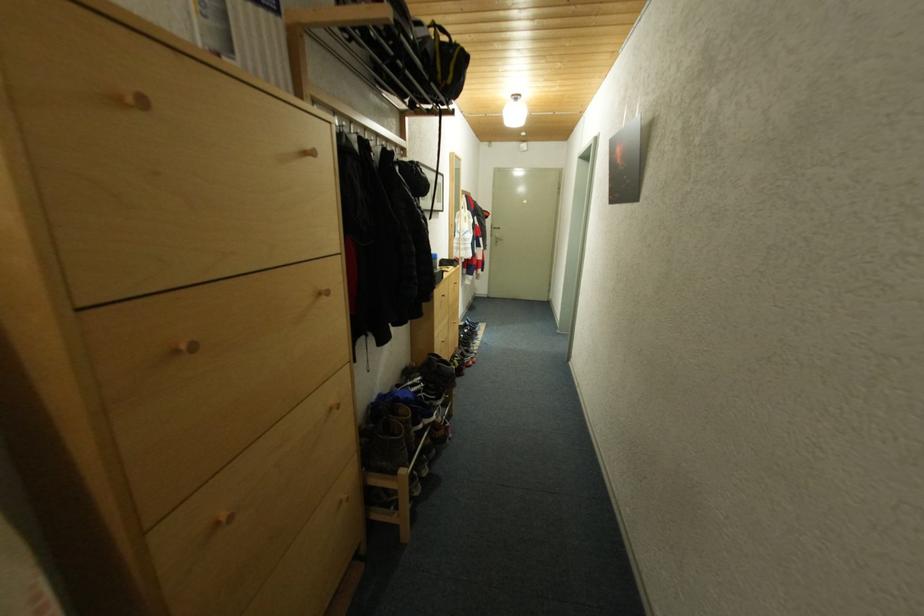
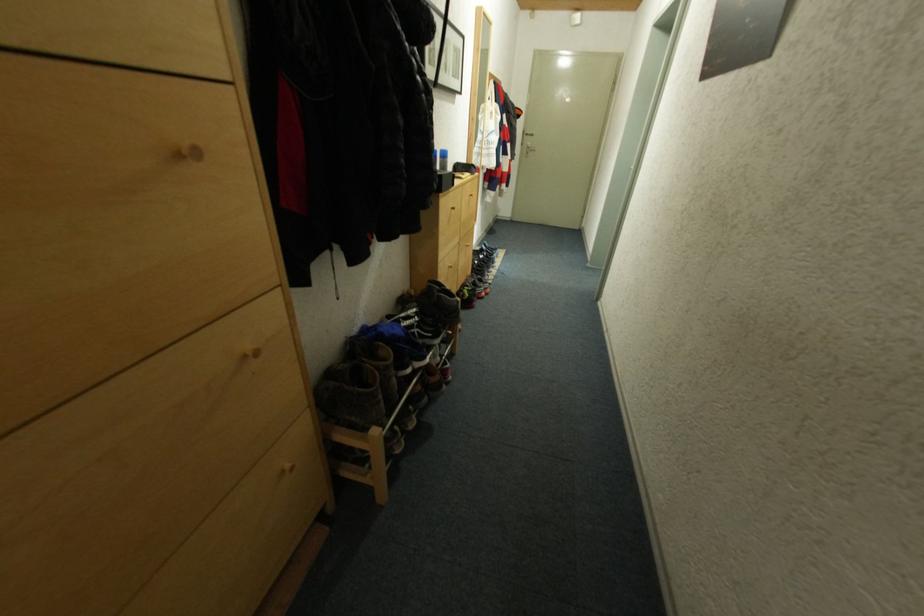
Question: Based on the continuous images, in which direction is the camera rotating? Reply with the corresponding letter.

Choices:
 (A) Left
 (B) Right
 (C) Up
 (D) Down

Answer: (D)